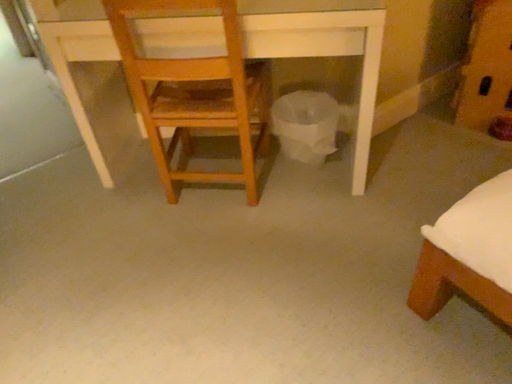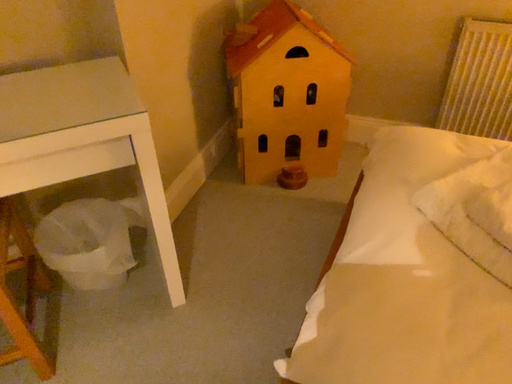
Question: How did the camera likely rotate when shooting the video?

Choices:
 (A) rotated right
 (B) rotated left

Answer: (A)